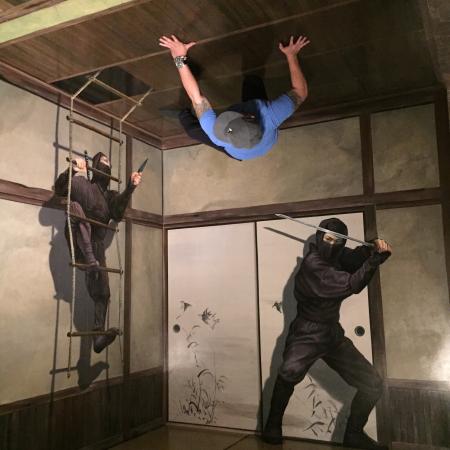
Locate an element on the screen. The image size is (450, 450). doors is located at coordinates (220, 301), (279, 265).